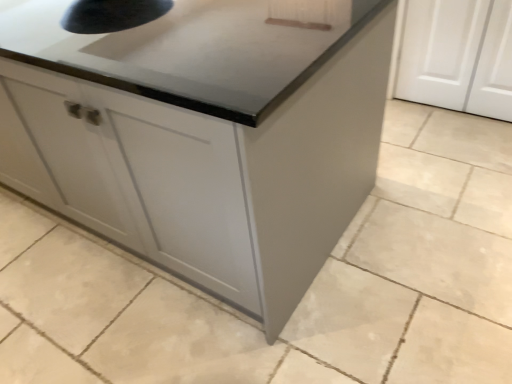
At what (x,y) coordinates should I click in order to perform the action: click on black glass countertop at upper center. Please return your answer as a coordinate pair (x, y). Looking at the image, I should click on (188, 47).

Describe the element at coordinates (188, 47) in the screenshot. I see `black glass countertop at upper center` at that location.

Find the location of `black glass countertop at upper center`. black glass countertop at upper center is located at coordinates (188, 47).